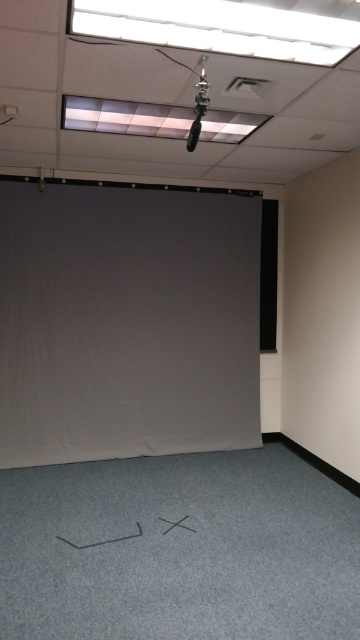
Which of these two, gray matte projection screen at center or black matte projector screen at right, stands shorter?

black matte projector screen at right

Based on the photo, is gray matte projection screen at center bigger than black matte projector screen at right?

Yes, gray matte projection screen at center is bigger than black matte projector screen at right.

Is point (108, 324) positioned behind point (272, 212)?

No.

At what (x,y) coordinates should I click in order to perform the action: click on gray matte projection screen at center. Please return your answer as a coordinate pair (x, y). The height and width of the screenshot is (640, 360). Looking at the image, I should click on (127, 323).